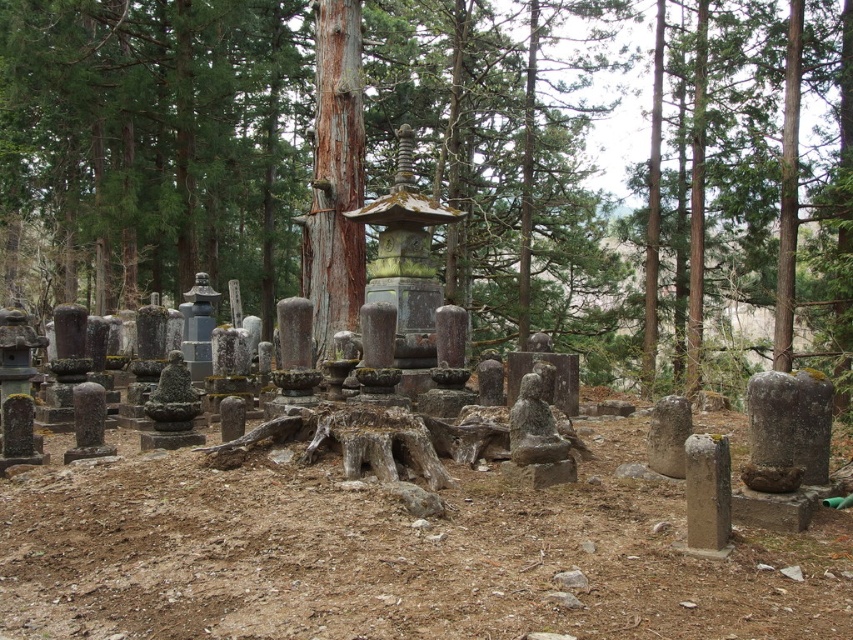
You are a botanist examining the trees in the forested cemetery. You notice the green mossy tree trunk at center and the smooth brown bark at center. Which of these two is positioned higher up?

The green mossy tree trunk at center is located above the smooth brown bark at center, so it is positioned higher up.

You are standing in the forested cemetery and want to walk from the point at coordinates point (605, 36) to the point at coordinates point (350, 314). Which direction should you face to move towards your destination?

Since point (605, 36) is further to the camera than point (350, 314), you should face towards the direction of the camera to move towards your destination.

You are a park ranger in the forest and need to place a 10 foot wide wooden bench between the green mossy tree trunk at center and the smooth brown bark at center. Is there enough space?

The green mossy tree trunk at center is 31.25 feet away from the smooth brown bark at center. Since the bench is only 10 feet wide, there is more than enough space to place it between them.